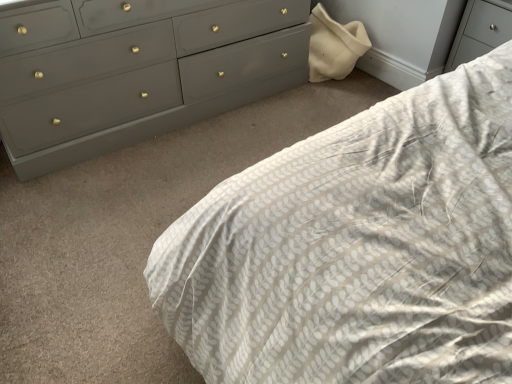
Where is `white textured fabric at center`? Image resolution: width=512 pixels, height=384 pixels. white textured fabric at center is located at coordinates (358, 248).

Measure the distance between white textured fabric at center and camera.

white textured fabric at center and camera are 23.56 inches apart from each other.

Describe the element at coordinates (358, 248) in the screenshot. This screenshot has width=512, height=384. I see `white textured fabric at center` at that location.

In order to face matte gray dresser at upper left, should I rotate leftwards or rightwards?

Turn left by 12.787 degrees to look at matte gray dresser at upper left.

What do you see at coordinates (145, 75) in the screenshot? The image size is (512, 384). I see `matte gray dresser at upper left` at bounding box center [145, 75].

Find the location of a particular element. matte gray dresser at upper left is located at coordinates (145, 75).

In order to click on white textured fabric at center in this screenshot , I will do `click(358, 248)`.

Is matte gray dresser at upper left at the right side of white textured fabric at center?

No, matte gray dresser at upper left is not to the right of white textured fabric at center.

In the image, is matte gray dresser at upper left positioned in front of or behind white textured fabric at center?

matte gray dresser at upper left is positioned farther from the viewer than white textured fabric at center.

Does point (18, 147) come in front of point (164, 316)?

That is False.

Based on the photo, from the image's perspective, does matte gray dresser at upper left appear higher than white textured fabric at center?

Yes, from the image's perspective, matte gray dresser at upper left is above white textured fabric at center.

From a real-world perspective, between matte gray dresser at upper left and white textured fabric at center, who is vertically higher?

white textured fabric at center, from a real-world perspective.

Can you confirm if matte gray dresser at upper left is thinner than white textured fabric at center?

Correct, the width of matte gray dresser at upper left is less than that of white textured fabric at center.

Does matte gray dresser at upper left have a greater height compared to white textured fabric at center?

No.

Who is smaller, matte gray dresser at upper left or white textured fabric at center?

Smaller between the two is matte gray dresser at upper left.

Is white textured fabric at center located within matte gray dresser at upper left?

No, white textured fabric at center is located outside of matte gray dresser at upper left.

Is matte gray dresser at upper left not close to white textured fabric at center?

That's right, there is a large distance between matte gray dresser at upper left and white textured fabric at center.

Is white textured fabric at center at the back of matte gray dresser at upper left?

No, white textured fabric at center is not at the back of matte gray dresser at upper left.

The height and width of the screenshot is (384, 512). In order to click on bed in front of the matte gray dresser at upper left in this screenshot , I will do `click(358, 248)`.

Would you say white textured fabric at center is to the left or to the right of matte gray dresser at upper left in the picture?

white textured fabric at center is to the right of matte gray dresser at upper left.

Is the position of white textured fabric at center more distant than that of matte gray dresser at upper left?

No, white textured fabric at center is closer to the viewer.

Is point (405, 134) farther from camera compared to point (90, 88)?

No.

Based on the photo, from the image's perspective, is white textured fabric at center on matte gray dresser at upper left?

No, from the image's perspective, white textured fabric at center is not above matte gray dresser at upper left.

From a real-world perspective, between white textured fabric at center and matte gray dresser at upper left, who is vertically lower?

matte gray dresser at upper left is physically lower.

Does white textured fabric at center have a greater width compared to matte gray dresser at upper left?

Indeed, white textured fabric at center has a greater width compared to matte gray dresser at upper left.

Is white textured fabric at center taller than matte gray dresser at upper left?

Indeed, white textured fabric at center has a greater height compared to matte gray dresser at upper left.

Who is smaller, white textured fabric at center or matte gray dresser at upper left?

Smaller between the two is matte gray dresser at upper left.

Would you say white textured fabric at center contains matte gray dresser at upper left?

Definitely not — matte gray dresser at upper left is not inside white textured fabric at center.

Is white textured fabric at center next to matte gray dresser at upper left and touching it?

white textured fabric at center is not next to matte gray dresser at upper left, and they're not touching.

Is white textured fabric at center looking in the opposite direction of matte gray dresser at upper left?

white textured fabric at center does not have its back to matte gray dresser at upper left.

Can you tell me how much white textured fabric at center and matte gray dresser at upper left differ in facing direction?

They differ by 90.7 degrees in their facing directions.

The image size is (512, 384). In order to click on chest of drawers behind the white textured fabric at center in this screenshot , I will do `click(145, 75)`.

Where is `chest of drawers on the left of white textured fabric at center`? The height and width of the screenshot is (384, 512). chest of drawers on the left of white textured fabric at center is located at coordinates (145, 75).

Image resolution: width=512 pixels, height=384 pixels. Identify the location of bed below the matte gray dresser at upper left (from the image's perspective). (358, 248).